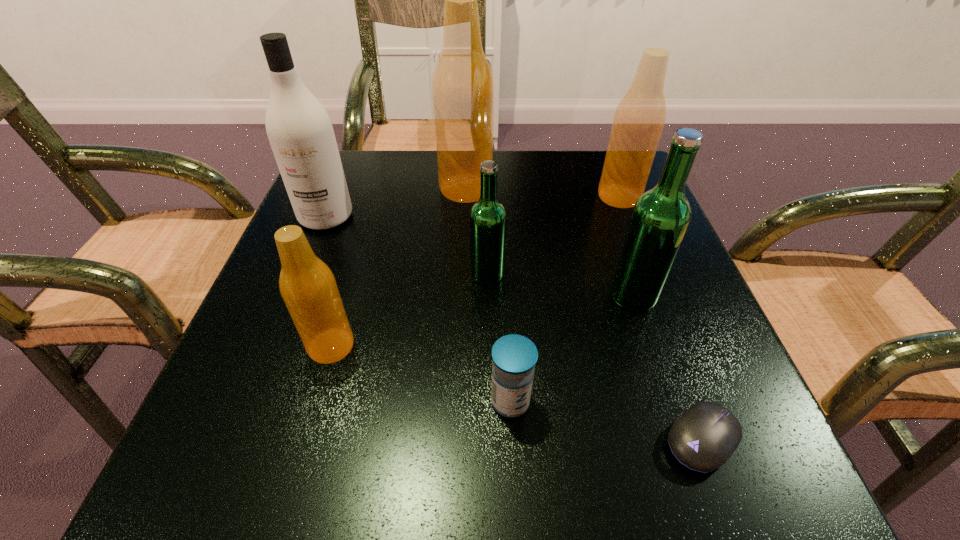
Locate an element on the screen. The image size is (960, 540). free space at the left edge is located at coordinates (242, 335).

Locate an element on the screen. free region at the right edge is located at coordinates (638, 405).

Find the location of `vacant area at the far left corner`. vacant area at the far left corner is located at coordinates [x=352, y=208].

The height and width of the screenshot is (540, 960). In the image, there is a desktop. What are the coordinates of `vacant region at the far right corner` in the screenshot? It's located at (580, 185).

The height and width of the screenshot is (540, 960). In order to click on free space that is in between the bigger green beer bottle and the computer mouse in this screenshot , I will do `click(668, 367)`.

At what (x,y) coordinates should I click in order to perform the action: click on free area in between the second biggest tan beer bottle and the white shampoo. Please return your answer as a coordinate pair (x, y). The width and height of the screenshot is (960, 540). Looking at the image, I should click on (472, 206).

Image resolution: width=960 pixels, height=540 pixels. I want to click on empty space between the tallest beer bottle and the smallest tan beer bottle, so click(398, 267).

Locate an element on the screen. This screenshot has height=540, width=960. vacant area that lies between the second tan beer bottle from right to left and the blue medicine is located at coordinates (488, 295).

Locate an element on the screen. blank region between the shampoo and the shortest object is located at coordinates (515, 328).

In order to click on free space between the white shampoo and the left green beer bottle in this screenshot , I will do `click(407, 245)`.